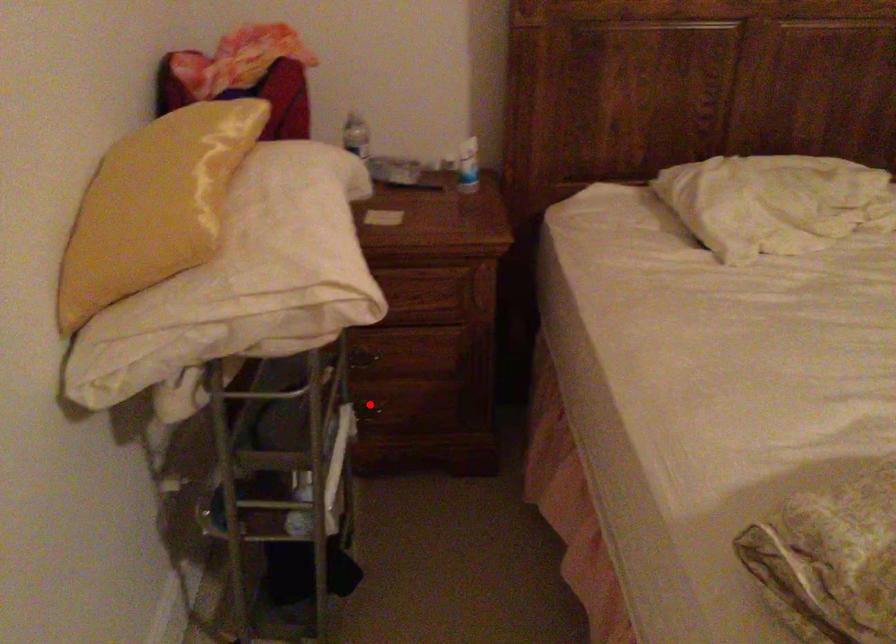
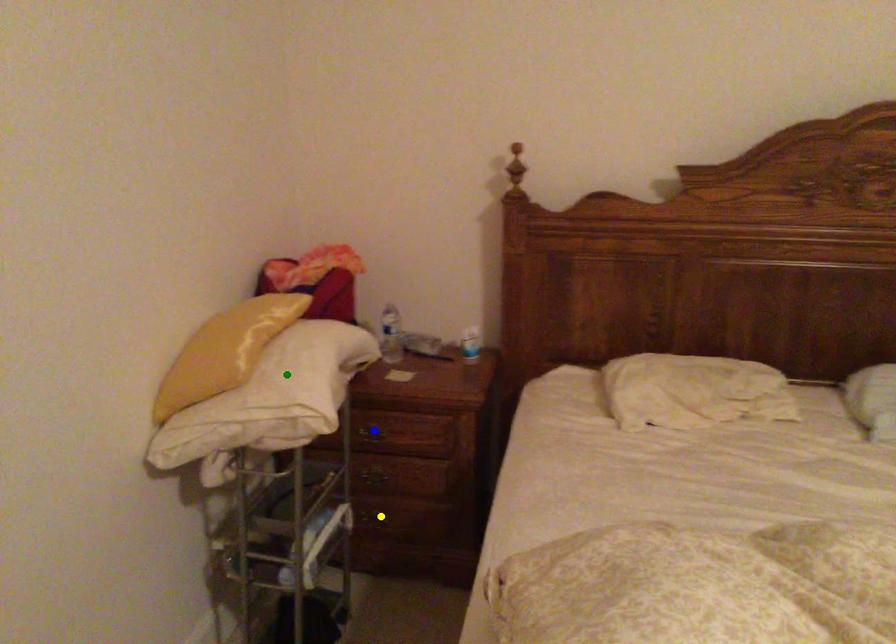
Question: I am providing you with two images of the same scene from different viewpoints. A red point is marked on the first image. You are given multiple points on the second image. Which point in image 2 is actually the same real-world point as the red point in image 1?

Choices:
 (A) yellow point
 (B) green point
 (C) blue point

Answer: (A)